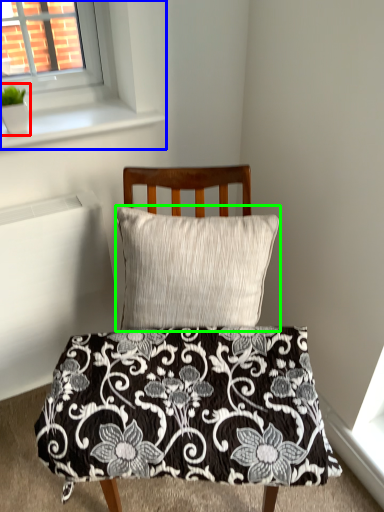
Question: Which object is the closest to the plant (highlighted by a red box)? Choose among these: window (highlighted by a blue box) or pillow (highlighted by a green box).

Choices:
 (A) window
 (B) pillow

Answer: (A)